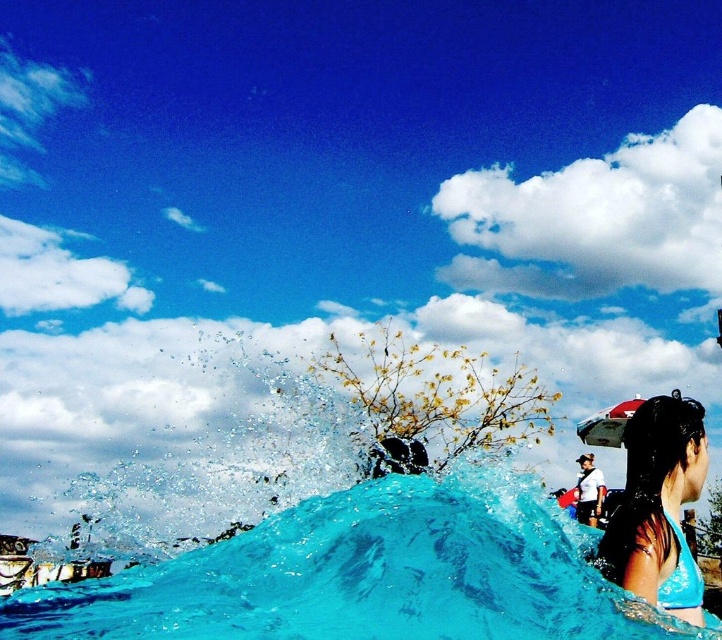
Between clear water splash at center and blue fabric bikini top at lower right, which one appears on the left side from the viewer's perspective?

From the viewer's perspective, clear water splash at center appears more on the left side.

Identify the location of clear water splash at center. (186, 444).

Does translucent blue water at center appear under clear water splash at center?

Correct, translucent blue water at center is located below clear water splash at center.

Is translucent blue water at center shorter than clear water splash at center?

Correct, translucent blue water at center is not as tall as clear water splash at center.

Describe the element at coordinates (365, 577) in the screenshot. This screenshot has height=640, width=722. I see `translucent blue water at center` at that location.

Locate an element on the screen. The width and height of the screenshot is (722, 640). translucent blue water at center is located at coordinates (365, 577).

Between translucent blue water at center and blue fabric bikini top at lower right, which one has less height?

With less height is translucent blue water at center.

Who is more forward, (443, 593) or (690, 472)?

Positioned in front is point (443, 593).

Locate an element on the screen. This screenshot has width=722, height=640. translucent blue water at center is located at coordinates (365, 577).